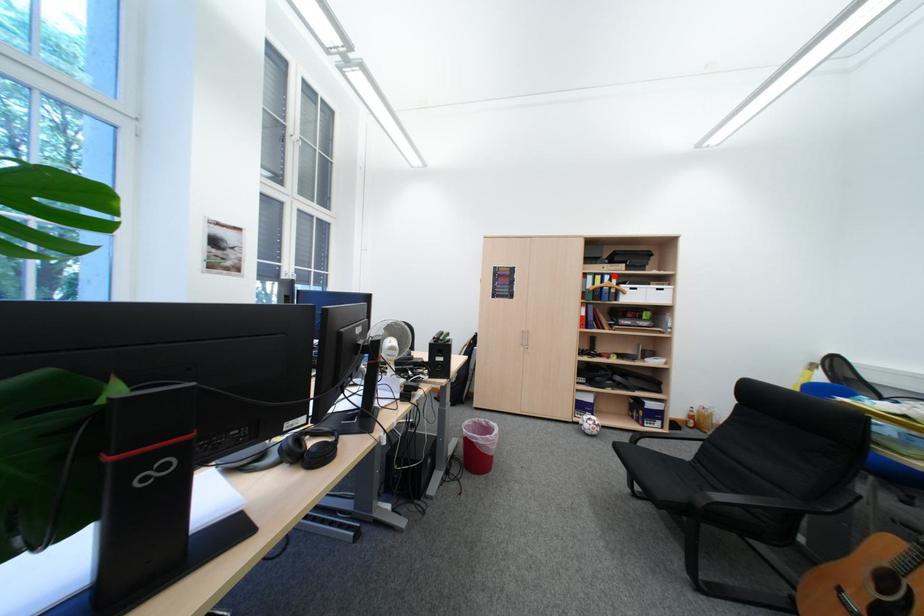
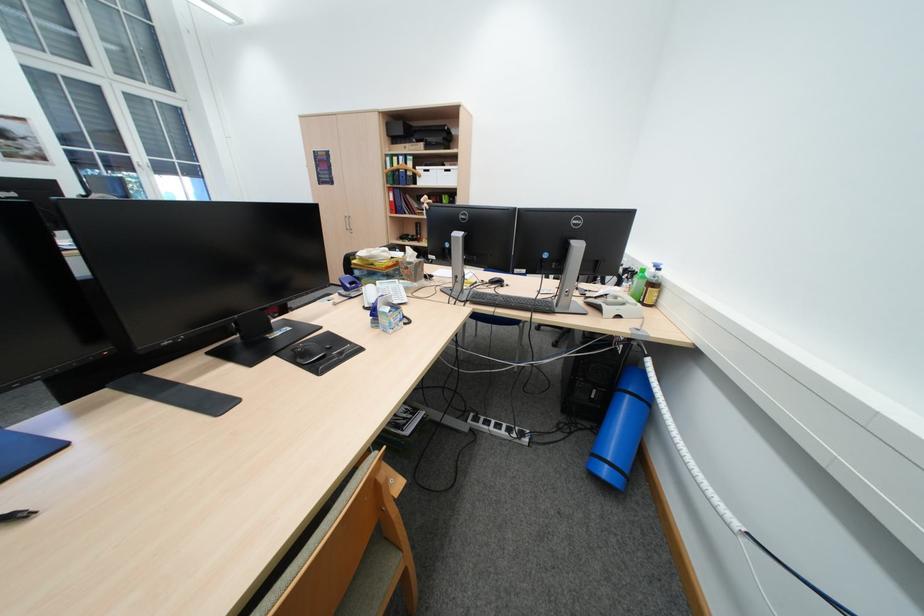
Find the pixel in the second image that matches the highlighted location in the first image.

(409, 156)